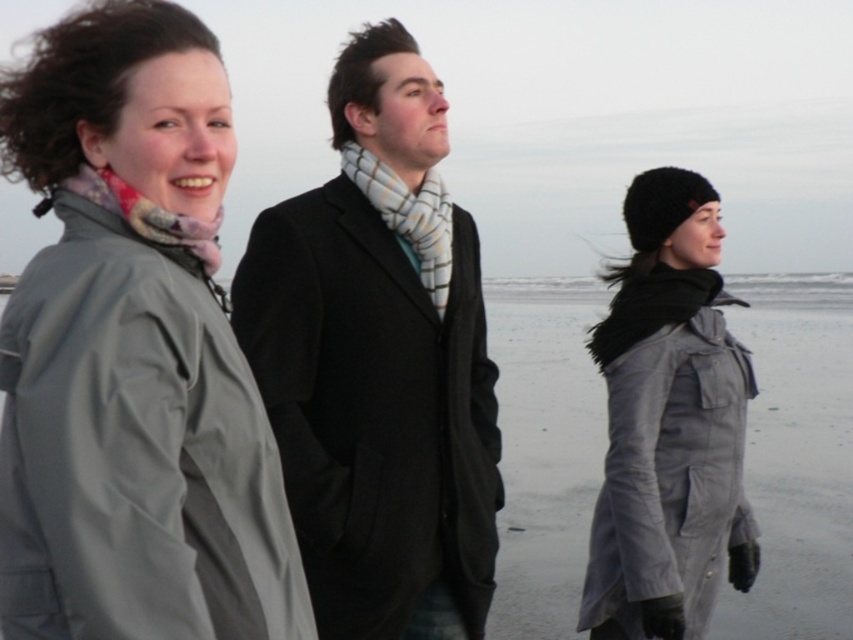
You are a photographer trying to capture a group photo of the matte gray coat at left and the black coat in the center. Based on their positions, which coat should you focus on first if you want to ensure both are in the frame?

The matte gray coat at left is located at point (132,355), so you should focus on the matte gray coat at left first to ensure both coats are within the frame.

You are standing at point A which is at coordinates point (157, 108) and want to walk to point B at coordinates point (372, 204). Given the scene described, will you have to walk towards or away from the beach? Please explain your reasoning based on the spatial relationship between the two points.

Point (157, 108) is in front of point (372, 204). Since you are starting at point A and moving to point B, you would be walking away from the beach because point B is behind point A relative to your starting position.